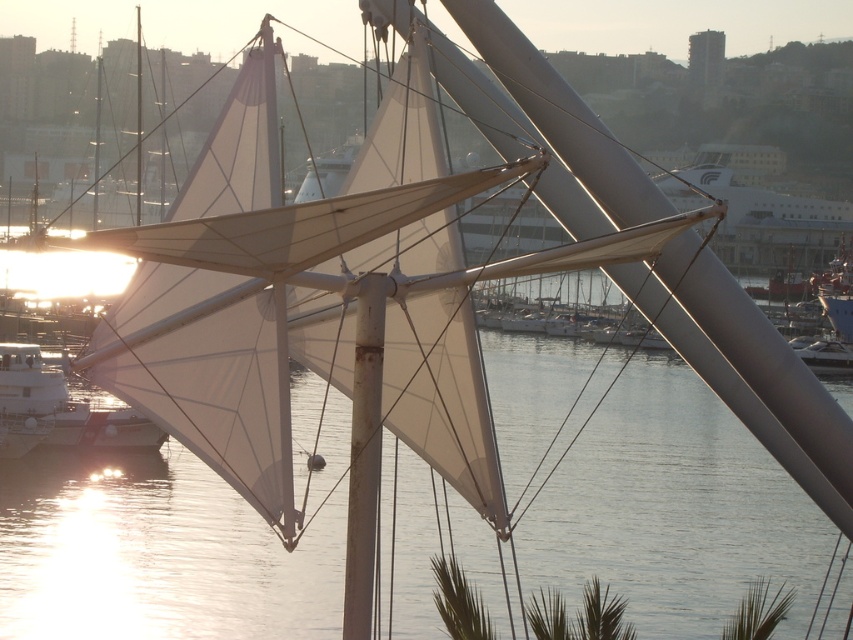
You are a photographer planning to capture the marina scene. You want to ensure that the transparent water at center and the white matte sailboat at lower left are both visible in your shot. Given their relative widths, which object should you position closer to the edge of the frame to maintain balance?

Since the transparent water at center is wider than the white matte sailboat at lower left, positioning the wider transparent water at center closer to the edge of the frame would help balance the composition by counteracting its larger size with placement.